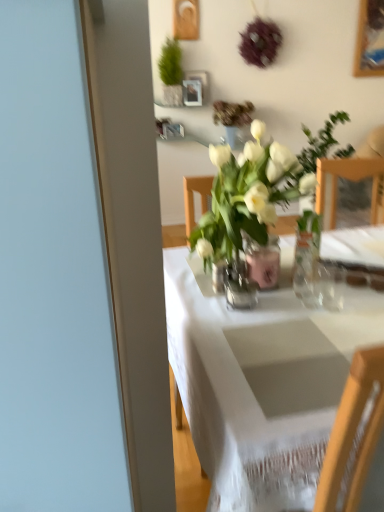
Where is `vacant area in front of pink glass vase at center, which appears as the 1th vase when viewed from the back`? The width and height of the screenshot is (384, 512). vacant area in front of pink glass vase at center, which appears as the 1th vase when viewed from the back is located at coordinates (246, 321).